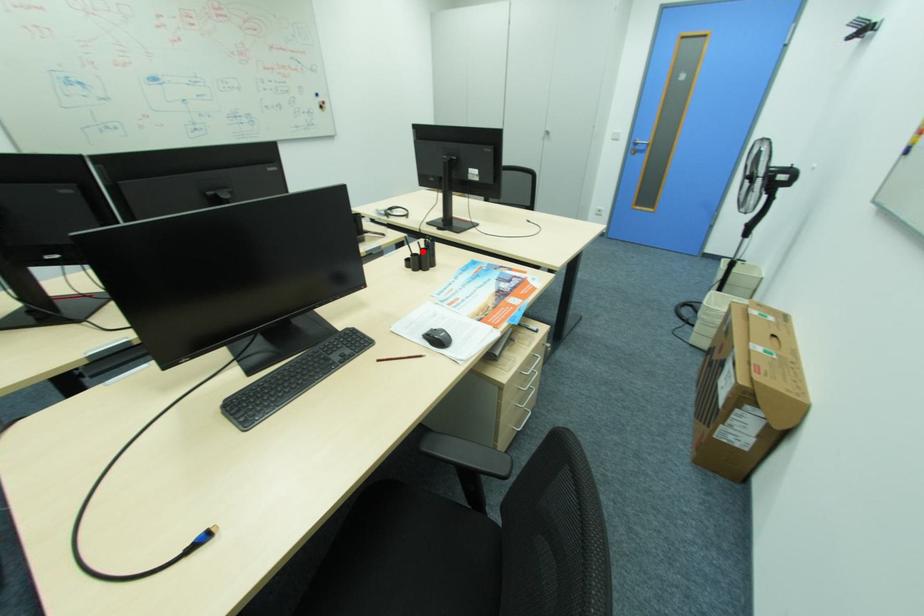
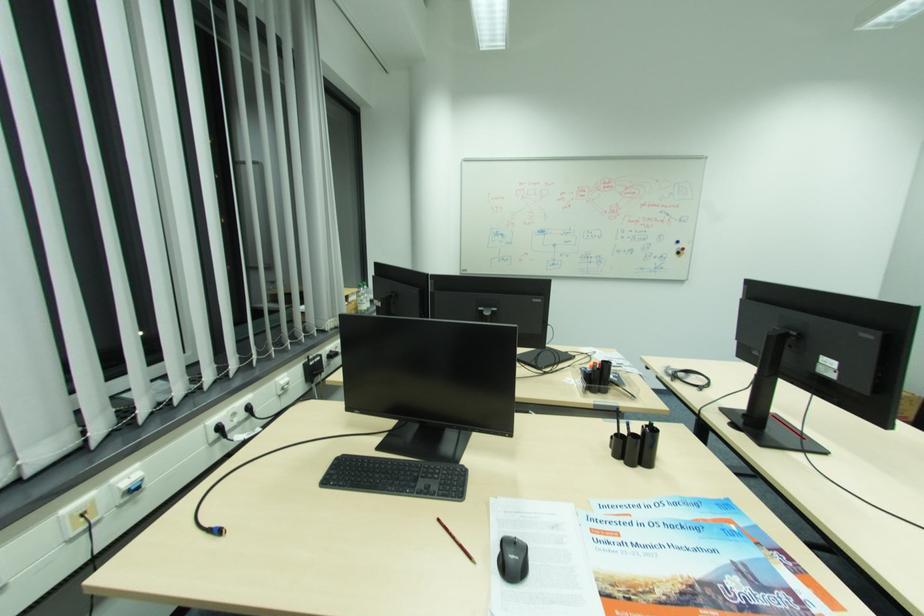
Question: A red point is marked in image1. In image2, is the corresponding 3D point closer to the camera or farther? Reply with the corresponding letter.

Choices:
 (A) The corresponding 3D point is closer.
 (B) The corresponding 3D point is farther.

Answer: (B)